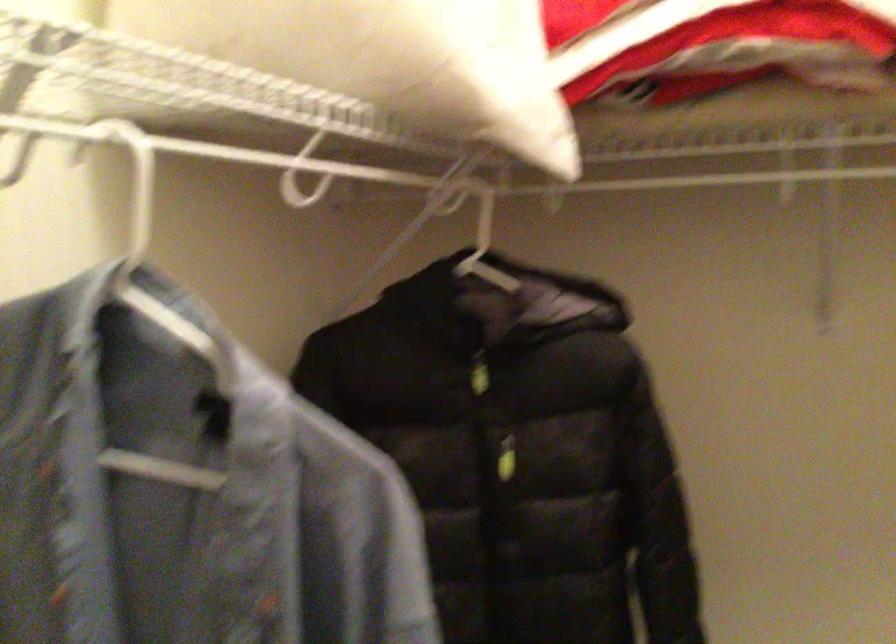
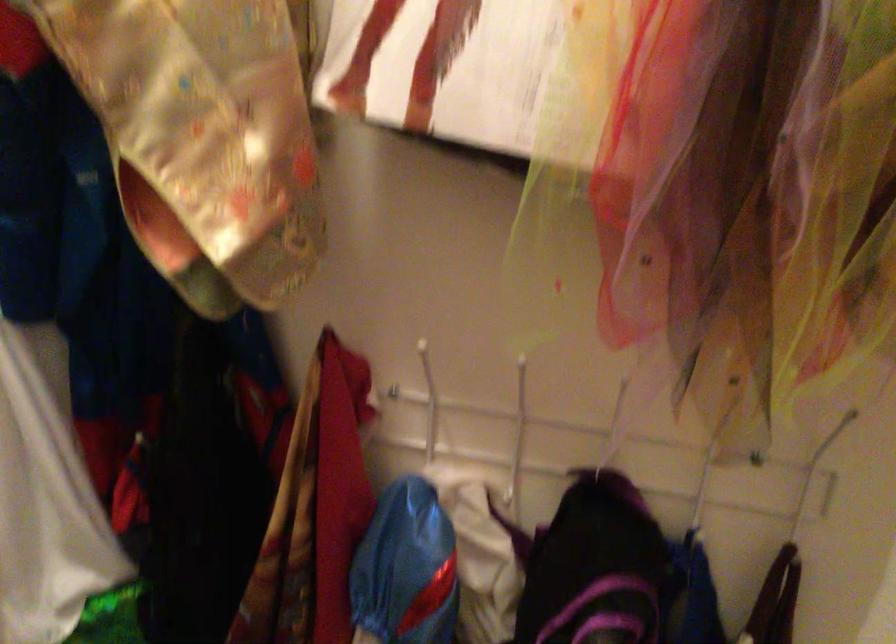
Based on the continuous images, in which direction is the camera rotating?

The rotation direction of the camera is right-down.